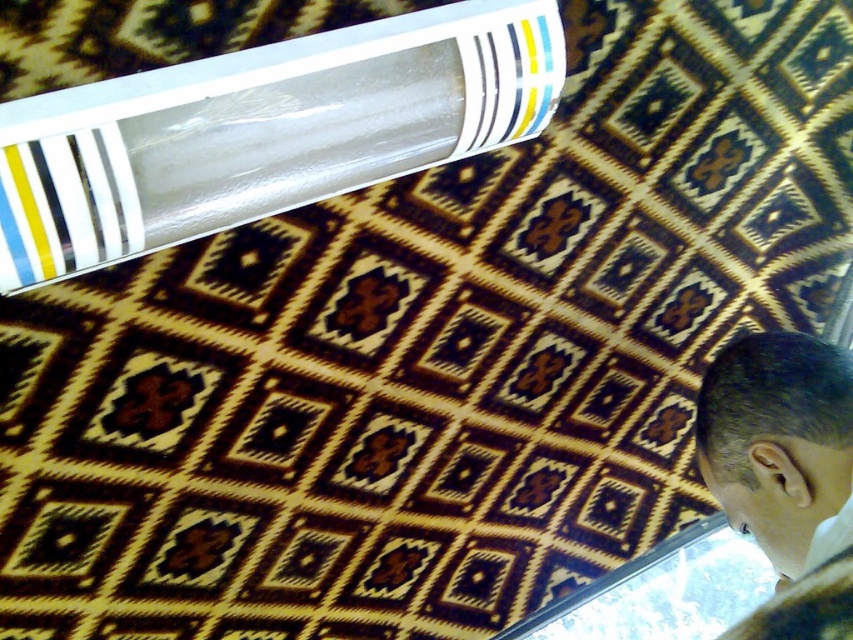
The height and width of the screenshot is (640, 853). In order to click on transparent plastic tube at upper left in this screenshot , I will do `click(264, 131)`.

Who is higher up, transparent plastic tube at upper left or dark brown hair at bottom right?

transparent plastic tube at upper left is higher up.

Between point (21, 252) and point (776, 476), which one is positioned behind?

The point (776, 476) is more distant.

Where is `transparent plastic tube at upper left`? This screenshot has width=853, height=640. transparent plastic tube at upper left is located at coordinates (264, 131).